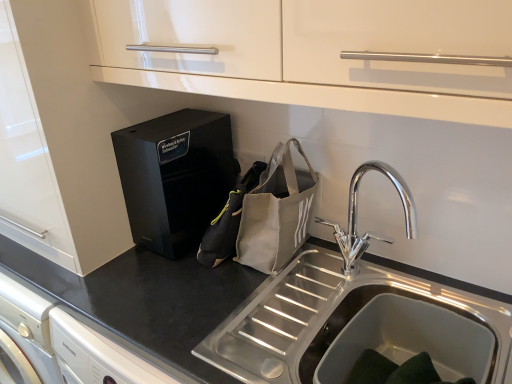
Question: Does gray fabric pouch at center, placed as the 1th pouch when sorted from left to right, lie in front of canvas tote bag at sink, positioned as the 1th pouch in right-to-left order?

Choices:
 (A) no
 (B) yes

Answer: (A)

Question: Does gray fabric pouch at center, placed as the 1th pouch when sorted from left to right, have a lesser width compared to canvas tote bag at sink, arranged as the 2th pouch when viewed from the left?

Choices:
 (A) yes
 (B) no

Answer: (A)

Question: Is gray fabric pouch at center, placed as the 1th pouch when sorted from left to right, bigger than canvas tote bag at sink, positioned as the 1th pouch in right-to-left order?

Choices:
 (A) no
 (B) yes

Answer: (A)

Question: Considering the relative sizes of gray fabric pouch at center, the second pouch viewed from the right, and canvas tote bag at sink, positioned as the 1th pouch in right-to-left order, in the image provided, is gray fabric pouch at center, the second pouch viewed from the right, smaller than canvas tote bag at sink, positioned as the 1th pouch in right-to-left order,?

Choices:
 (A) yes
 (B) no

Answer: (A)

Question: Is gray fabric pouch at center, placed as the 1th pouch when sorted from left to right, turned away from canvas tote bag at sink, arranged as the 2th pouch when viewed from the left?

Choices:
 (A) no
 (B) yes

Answer: (B)

Question: From their relative heights in the image, would you say black matte countertop at center is taller or shorter than chrome metallic faucet at upper right?

Choices:
 (A) short
 (B) tall

Answer: (B)

Question: Choose the correct answer: Is black matte countertop at center inside chrome metallic faucet at upper right or outside it?

Choices:
 (A) outside
 (B) inside

Answer: (A)

Question: Is black matte countertop at center bigger or smaller than chrome metallic faucet at upper right?

Choices:
 (A) small
 (B) big

Answer: (B)

Question: Visually, is black matte countertop at center positioned to the left or to the right of chrome metallic faucet at upper right?

Choices:
 (A) left
 (B) right

Answer: (A)

Question: In terms of height, does canvas tote bag at sink, positioned as the 1th pouch in right-to-left order, look taller or shorter compared to gray fabric pouch at center, placed as the 1th pouch when sorted from left to right?

Choices:
 (A) short
 (B) tall

Answer: (B)

Question: In terms of width, does canvas tote bag at sink, arranged as the 2th pouch when viewed from the left, look wider or thinner when compared to gray fabric pouch at center, the second pouch viewed from the right?

Choices:
 (A) wide
 (B) thin

Answer: (A)

Question: From the image's perspective, is canvas tote bag at sink, positioned as the 1th pouch in right-to-left order, above or below gray fabric pouch at center, placed as the 1th pouch when sorted from left to right?

Choices:
 (A) above
 (B) below

Answer: (A)

Question: Based on their positions, is canvas tote bag at sink, arranged as the 2th pouch when viewed from the left, located to the left or right of gray fabric pouch at center, placed as the 1th pouch when sorted from left to right?

Choices:
 (A) right
 (B) left

Answer: (A)

Question: In terms of size, does canvas tote bag at sink, positioned as the 1th pouch in right-to-left order, appear bigger or smaller than black glossy speaker at center?

Choices:
 (A) small
 (B) big

Answer: (A)

Question: Is canvas tote bag at sink, positioned as the 1th pouch in right-to-left order, wider or thinner than black glossy speaker at center?

Choices:
 (A) wide
 (B) thin

Answer: (B)